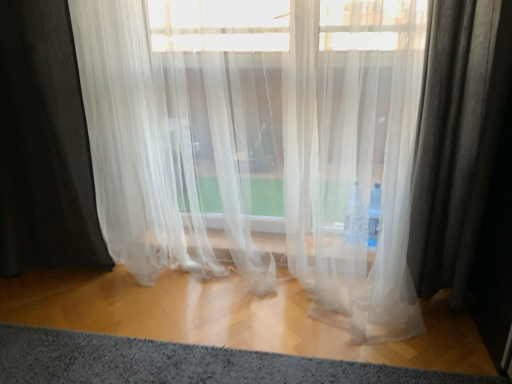
Locate an element on the screen. The width and height of the screenshot is (512, 384). vacant space in front of translucent white curtain at center is located at coordinates (228, 348).